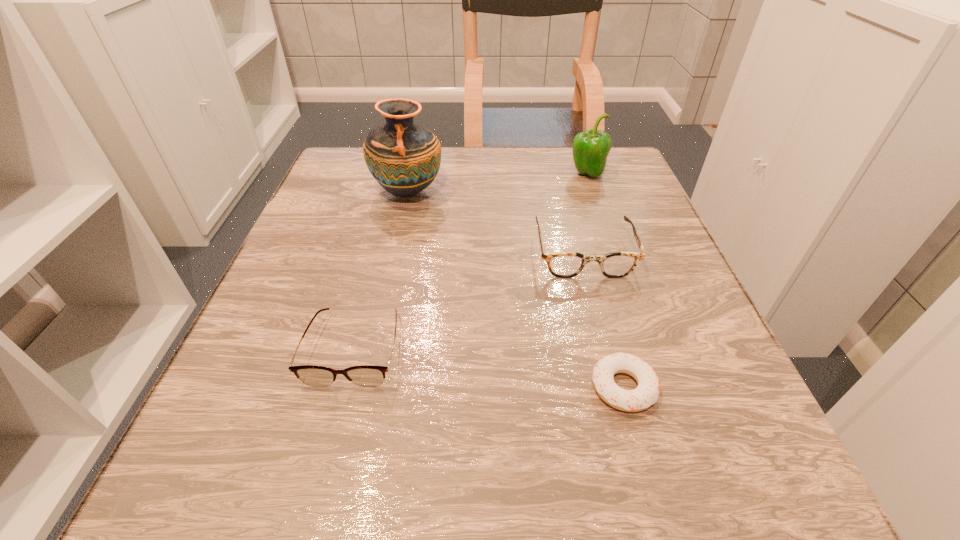
This screenshot has width=960, height=540. Find the location of `pottery`. pottery is located at coordinates (404, 158).

The height and width of the screenshot is (540, 960). I want to click on bell pepper, so click(590, 148).

The width and height of the screenshot is (960, 540). Identify the location of the farther spectacles. (563, 264).

Locate an element on the screen. The image size is (960, 540). the third nearest object is located at coordinates (563, 264).

Where is `the fourth tallest object`? the fourth tallest object is located at coordinates (364, 375).

You are a GUI agent. You are given a task and a screenshot of the screen. Output one action in this format:
    pyautogui.click(x=<x>, y=<y>)
    Task: Click on the left spectacles
    
    Given the screenshot: What is the action you would take?
    pyautogui.click(x=364, y=375)

Identify the location of doughnut. click(647, 392).

I want to click on free region located 0.100m on the right of the pottery, so click(491, 192).

Locate an element on the screen. vacant point located 0.120m on the left of the fourth shortest object is located at coordinates (516, 174).

I want to click on vacant space situated 0.190m on the frame of the taller spectacles, so click(615, 373).